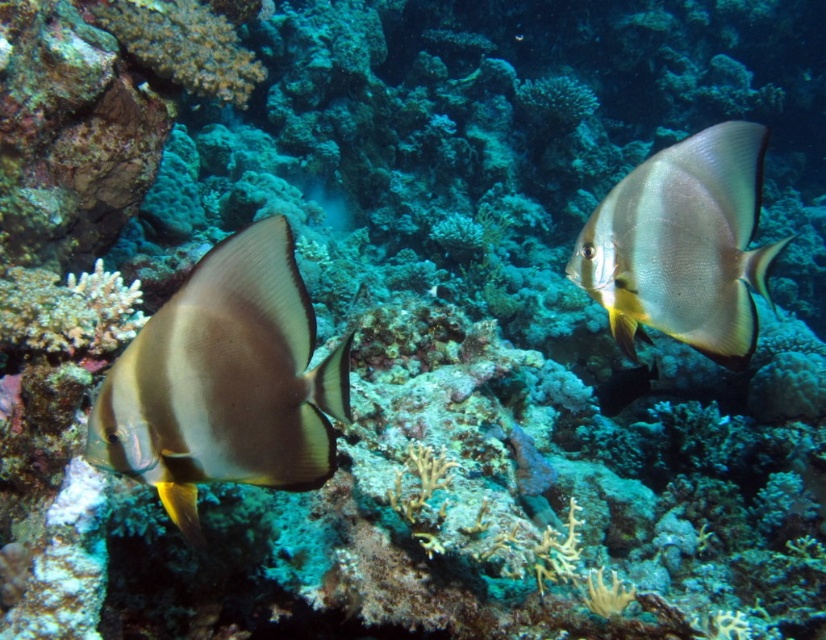
You are a marine biologist studying the underwater scene. You observe two batfish near the coral reef. One of them is located at point (224, 381). Which batfish is this point referring to?

The point (224, 381) corresponds to the matte silver fish at left.

You are a marine biologist observing the underwater scene. You notice two fish species in the image. Which fish is smaller in size between the matte silver fish at left and the silvery matte batfish at upper right?

The matte silver fish at left has a smaller size compared to the silvery matte batfish at upper right, so the matte silver fish at left is smaller.